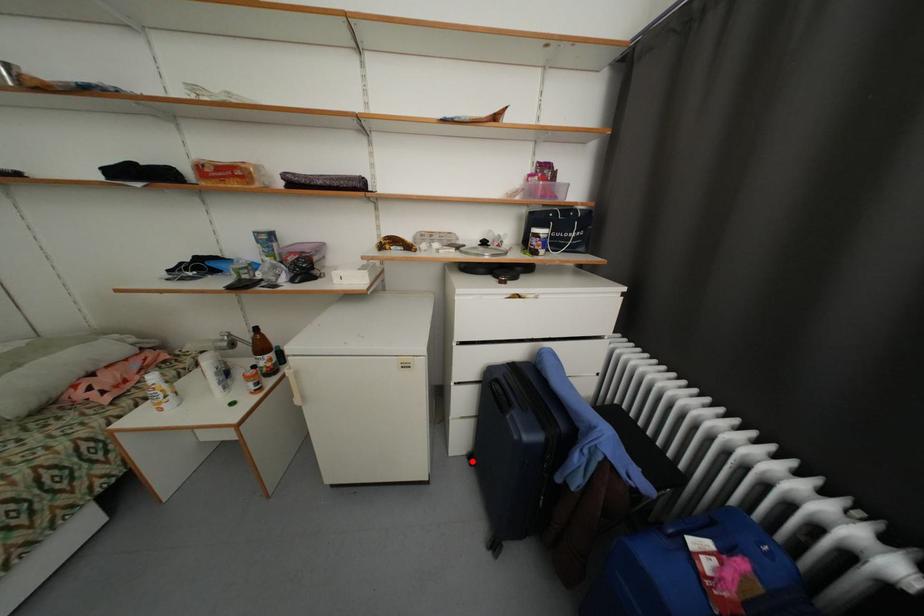
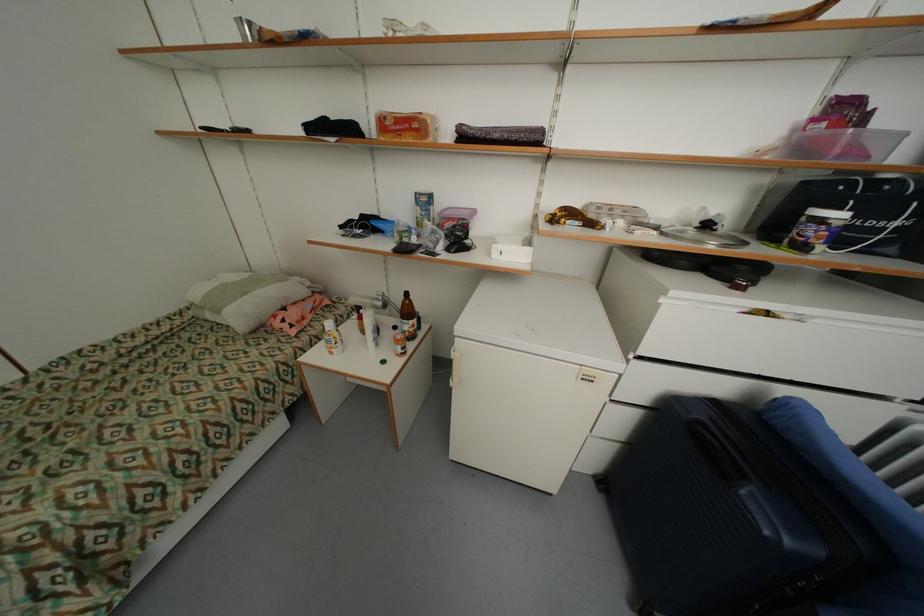
Question: I am providing you with two images of the same scene from different viewpoints. A red point is shown in image1. For the corresponding object point in image2, is it positioned nearer or farther from the camera?

Choices:
 (A) Nearer
 (B) Farther

Answer: (A)